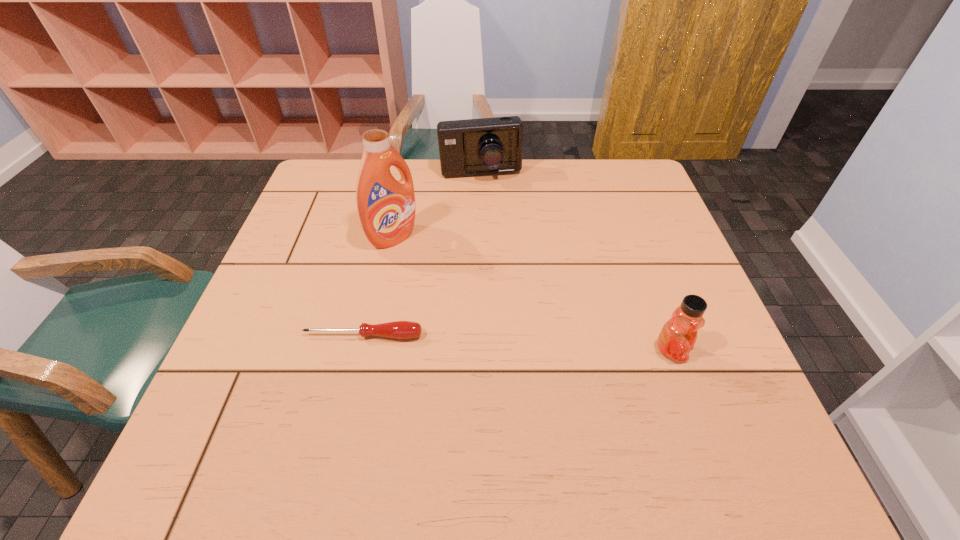
This screenshot has height=540, width=960. Identify the location of free spot between the farthest object and the second farthest object. [437, 206].

This screenshot has width=960, height=540. Find the location of `empty space between the honey and the camera`. empty space between the honey and the camera is located at coordinates (576, 262).

Find the location of `free spot between the rightmost object and the farthest object`. free spot between the rightmost object and the farthest object is located at coordinates (576, 262).

Locate which object ranks in proximity to the rightmost object. Please provide its 2D coordinates. Your answer should be formatted as a tuple, i.e. [(x, y)], where the tuple contains the x and y coordinates of a point satisfying the conditions above.

[(399, 329)]

Select which object appears as the second closest to the tallest object. Please provide its 2D coordinates. Your answer should be formatted as a tuple, i.e. [(x, y)], where the tuple contains the x and y coordinates of a point satisfying the conditions above.

[(399, 329)]

Identify the location of free space in the image that satisfies the following two spatial constraints: 1. at the tip of the shortest object; 2. on the front label of the rightmost object. The width and height of the screenshot is (960, 540). (360, 350).

Find the location of a particular element. vacant space that satisfies the following two spatial constraints: 1. on the front side of the farthest object; 2. on the front label of the rightmost object is located at coordinates (481, 350).

Where is `vacant region that satisfies the following two spatial constraints: 1. at the tip of the rightmost object; 2. on the front label of the shortest object`? The height and width of the screenshot is (540, 960). vacant region that satisfies the following two spatial constraints: 1. at the tip of the rightmost object; 2. on the front label of the shortest object is located at coordinates (360, 350).

This screenshot has width=960, height=540. Find the location of `blank space that satisfies the following two spatial constraints: 1. on the front side of the camera; 2. on the front label of the honey`. blank space that satisfies the following two spatial constraints: 1. on the front side of the camera; 2. on the front label of the honey is located at coordinates (481, 350).